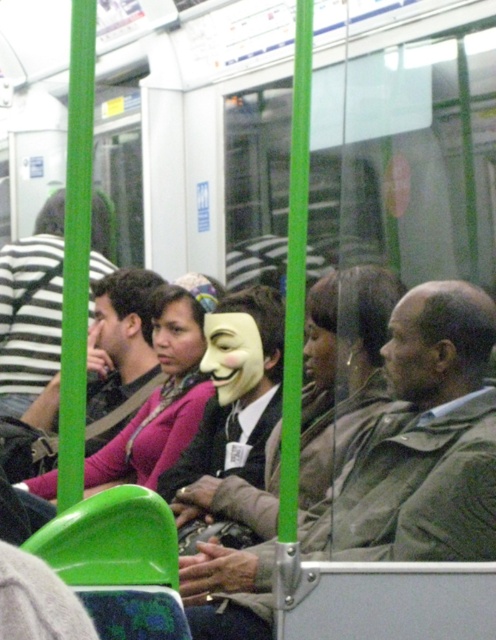
Can you confirm if white matte mask at center is shorter than matte black jacket at left?

Yes, white matte mask at center is shorter than matte black jacket at left.

Image resolution: width=496 pixels, height=640 pixels. Describe the element at coordinates (421, 442) in the screenshot. I see `white matte mask at center` at that location.

In order to click on white matte mask at center in this screenshot , I will do `click(421, 442)`.